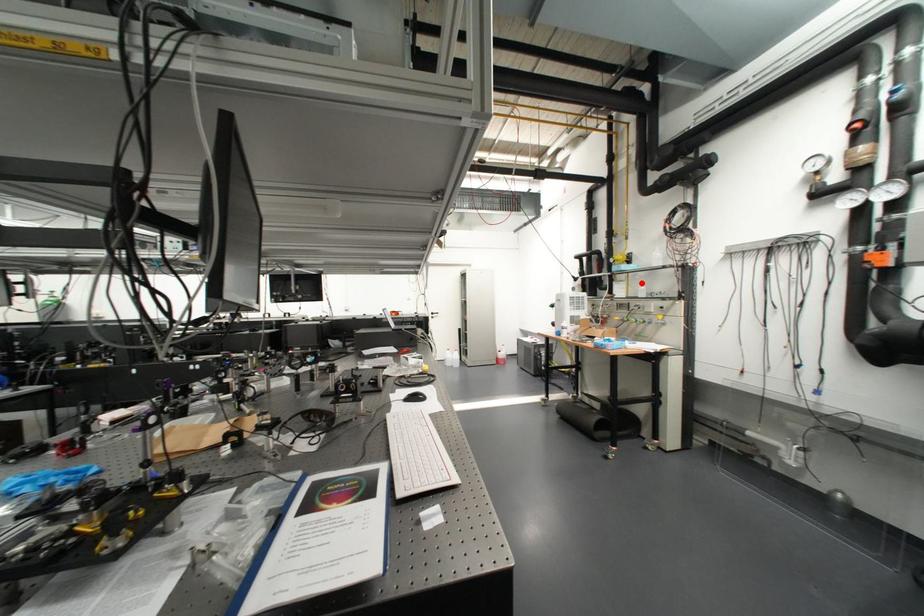
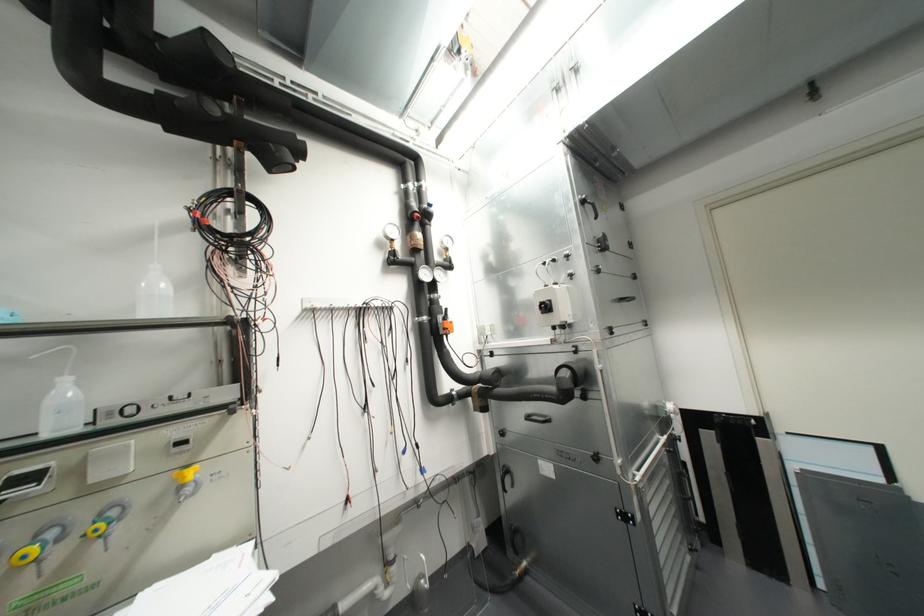
Where in the second image is the point corresponding to the highlighted location from the first image?

(66, 379)